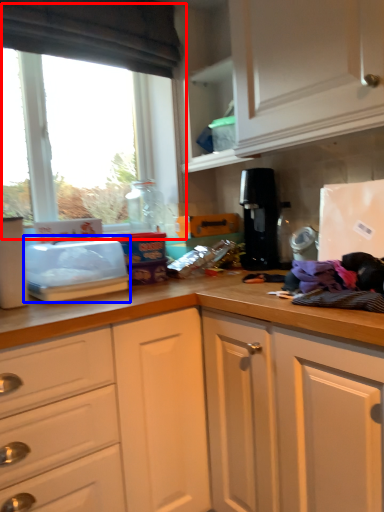
Question: Which object is closer to the camera taking this photo, window (highlighted by a red box) or appliance (highlighted by a blue box)?

Choices:
 (A) window
 (B) appliance

Answer: (B)